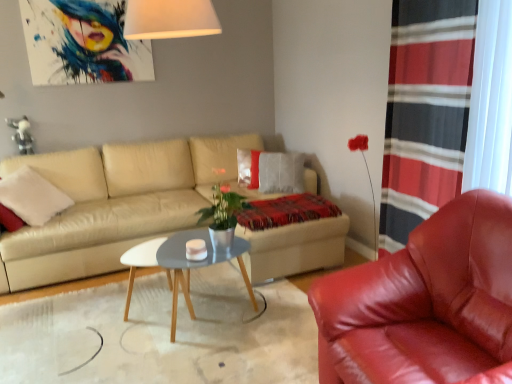
Question: From a real-world perspective, is red striped curtain at right above or below beige leather couch at center?

Choices:
 (A) below
 (B) above

Answer: (B)

Question: Is red striped curtain at right spatially inside beige leather couch at center, or outside of it?

Choices:
 (A) inside
 (B) outside

Answer: (B)

Question: Which is nearer to the shiny red leather armchair at right?

Choices:
 (A) beige leather couch at center
 (B) red striped curtain at right
 (C) plaid woolen blanket at center
 (D) gray wooden coffee table at center

Answer: (B)

Question: Which of these objects is positioned closest to the gray wooden coffee table at center?

Choices:
 (A) red striped curtain at right
 (B) plaid woolen blanket at center
 (C) beige leather couch at center
 (D) shiny red leather armchair at right

Answer: (B)